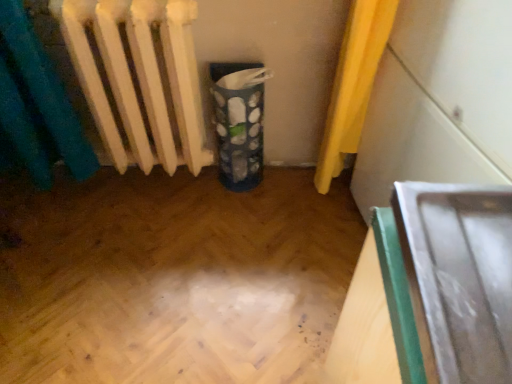
Find the location of a particular element. The width and height of the screenshot is (512, 384). vacant area that is in front of blue fabric recycling bin at center is located at coordinates (241, 219).